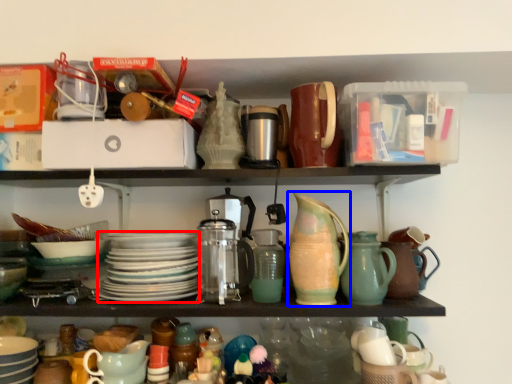
Question: Which object appears farthest to the camera in this image, platter (highlighted by a red box) or jug (highlighted by a blue box)?

Choices:
 (A) platter
 (B) jug

Answer: (A)